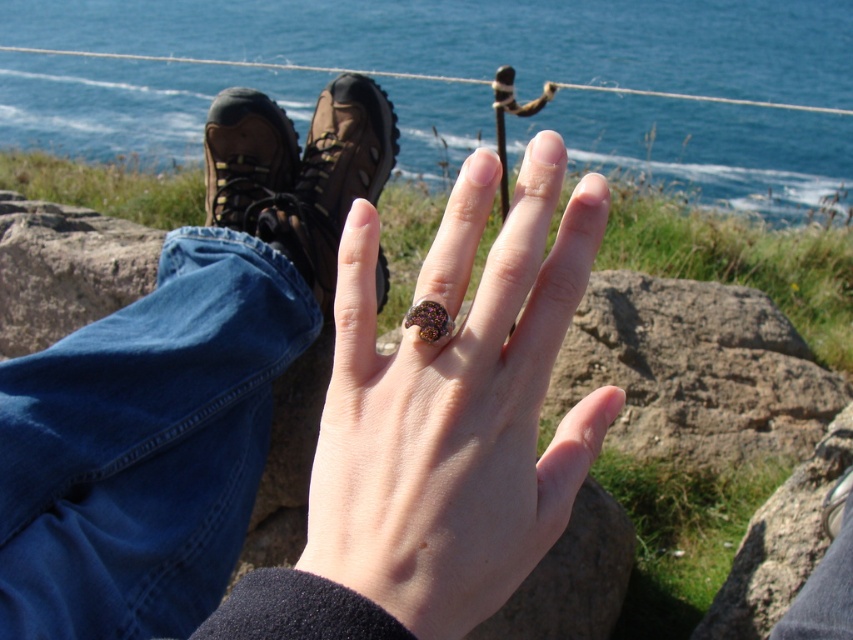
Question: Does shiny gold ring at center appear on the right side of rough textured rock at lower right?

Choices:
 (A) no
 (B) yes

Answer: (A)

Question: Can you confirm if shiny metallic ring at center is bigger than matte brown hiking boot at left?

Choices:
 (A) yes
 (B) no

Answer: (B)

Question: Which object is positioned closest to the shiny metallic ring at center?

Choices:
 (A) matte brown hiking boot at left
 (B) shiny gold ring at center
 (C) smooth gray rock at lower left
 (D) matte brown hiking boot at upper center

Answer: (B)

Question: Which point is closer to the camera?

Choices:
 (A) shiny purple gemstone ring at center
 (B) blue water at upper center
 (C) smooth gray rock at lower left
 (D) rough textured rock at lower right

Answer: (A)

Question: Which of these objects is positioned farthest from the blue water at upper center?

Choices:
 (A) smooth gray rock at lower left
 (B) matte brown hiking boot at upper center
 (C) shiny gold ring at center
 (D) shiny purple gemstone ring at center

Answer: (D)

Question: Can you confirm if shiny metallic ring at center is positioned to the right of rough textured rock at lower right?

Choices:
 (A) yes
 (B) no

Answer: (B)